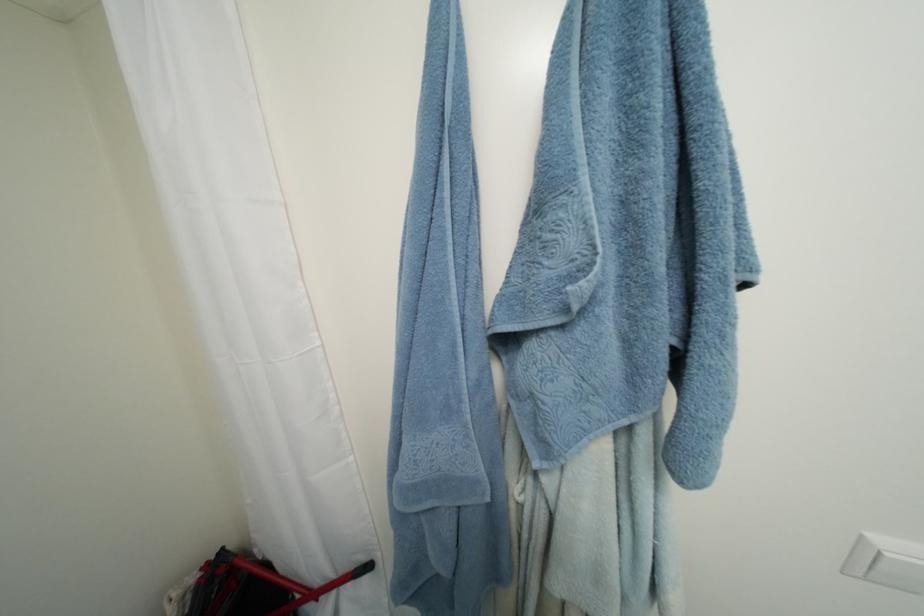
What do you see at coordinates (896, 570) in the screenshot?
I see `the white light switch` at bounding box center [896, 570].